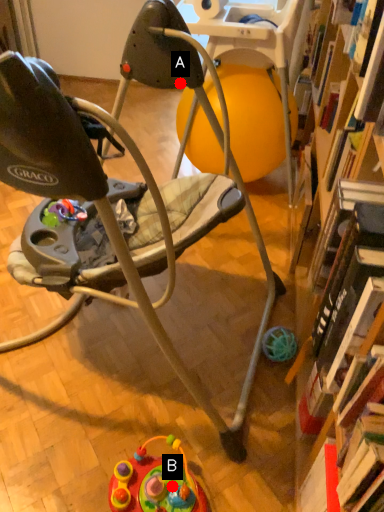
Question: Two points are circled on the image, labeled by A and B beside each circle. Which point appears closest to the camera in this image?

Choices:
 (A) A is closer
 (B) B is closer

Answer: (B)